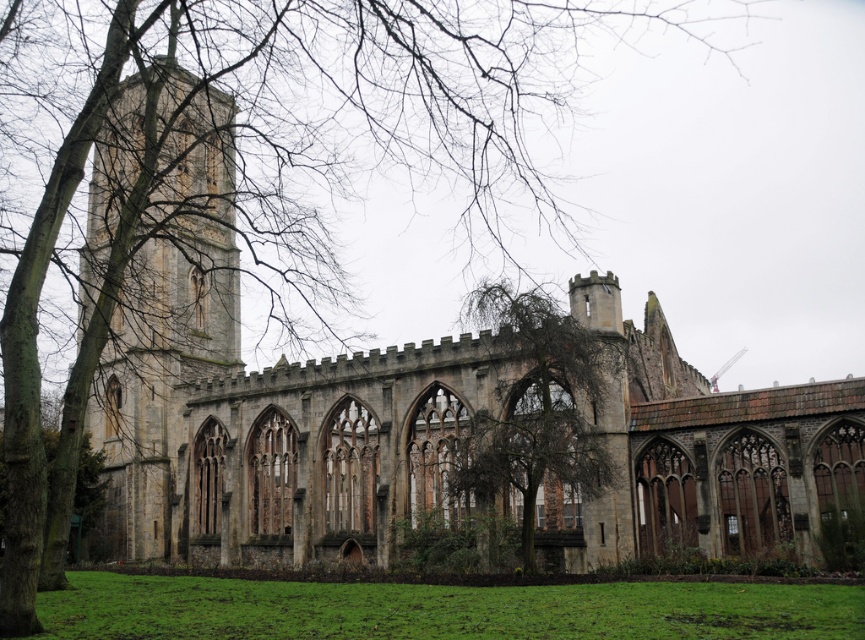
Which is above, stone tower at left or green grass at lower center?

stone tower at left

Between stone tower at left and green grass at lower center, which one has less height?

green grass at lower center is shorter.

Does point (106, 416) come farther from viewer compared to point (747, 582)?

Yes, it is behind point (747, 582).

In order to click on stone tower at left in this screenshot , I will do `click(171, 337)`.

Can you confirm if green grass at lower center is positioned below brown textured tree at center?

Yes.

I want to click on green grass at lower center, so click(441, 609).

Can you confirm if stone tower at left is taller than brown textured tree at center?

Yes, stone tower at left is taller than brown textured tree at center.

In the scene shown: Can you confirm if stone tower at left is positioned to the right of brown textured tree at center?

Incorrect, stone tower at left is not on the right side of brown textured tree at center.

Which is behind, point (127, 452) or point (564, 419)?

The point (127, 452) is more distant.

Locate an element on the screen. stone tower at left is located at coordinates (171, 337).